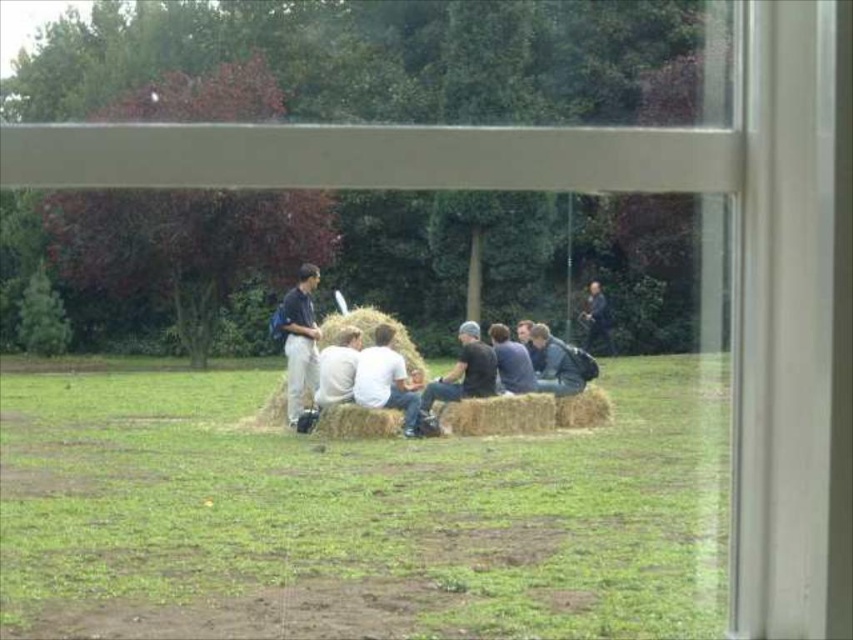
Question: Which point is farther to the camera?

Choices:
 (A) light brown straw bale at center
 (B) dark blue shirt at center
 (C) dark blue jeans at center
 (D) dark blue leather jacket at center

Answer: (C)

Question: Among these objects, which one is farthest from the camera?

Choices:
 (A) light brown straw bale at center
 (B) dark gray knit cap at center
 (C) dark blue leather jacket at center

Answer: (C)

Question: Does green grass at center have a larger size compared to white cotton shirt at center?

Choices:
 (A) no
 (B) yes

Answer: (B)

Question: Can you confirm if white matte shirt at center is thinner than dark blue jeans at center?

Choices:
 (A) no
 (B) yes

Answer: (B)

Question: Does green grass at center come behind dark blue leather jacket at center?

Choices:
 (A) no
 (B) yes

Answer: (A)

Question: Which point is closer to the camera taking this photo?

Choices:
 (A) (343, 356)
 (B) (392, 404)
 (C) (361, 333)

Answer: (B)